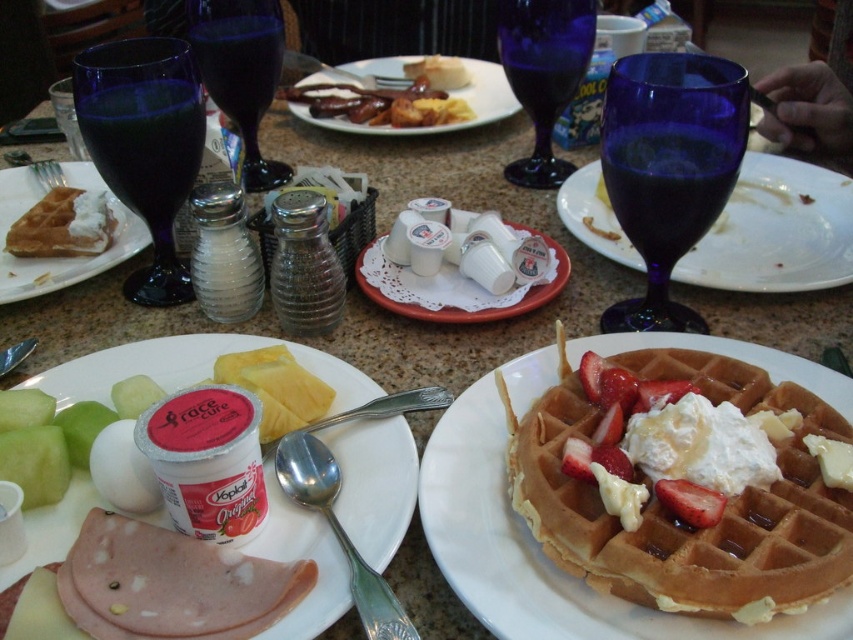
Who is positioned more to the left, golden brown waffle with cream and strawberries at center or white matte waffle at center?

white matte waffle at center

Who is positioned more to the right, golden brown waffle with cream and strawberries at center or white matte waffle at center?

golden brown waffle with cream and strawberries at center is more to the right.

You are a GUI agent. You are given a task and a screenshot of the screen. Output one action in this format:
    pyautogui.click(x=<x>, y=<y>)
    Task: Click on the golden brown waffle with cream and strawberries at center
    Image resolution: width=853 pixels, height=640 pixels.
    Given the screenshot: What is the action you would take?
    pyautogui.click(x=672, y=513)

Who is taller, matte glass plate at center or transparent blue glass at upper center?

With more height is matte glass plate at center.

Between matte glass plate at center and transparent blue glass at upper center, which one appears on the right side from the viewer's perspective?

matte glass plate at center is more to the right.

Does point (743, 241) come in front of point (550, 125)?

Yes, it is in front of point (550, 125).

I want to click on matte glass plate at center, so click(776, 230).

Between transparent blue glass at upper right and white paper plate at center, which one has more height?

transparent blue glass at upper right is taller.

Is transparent blue glass at upper right closer to camera compared to white paper plate at center?

Yes, transparent blue glass at upper right is closer to the viewer.

Identify the location of transparent blue glass at upper right. (669, 168).

You are a GUI agent. You are given a task and a screenshot of the screen. Output one action in this format:
    pyautogui.click(x=<x>, y=<y>)
    Task: Click on the transparent blue glass at upper right
    The height and width of the screenshot is (640, 853).
    Given the screenshot: What is the action you would take?
    pyautogui.click(x=669, y=168)